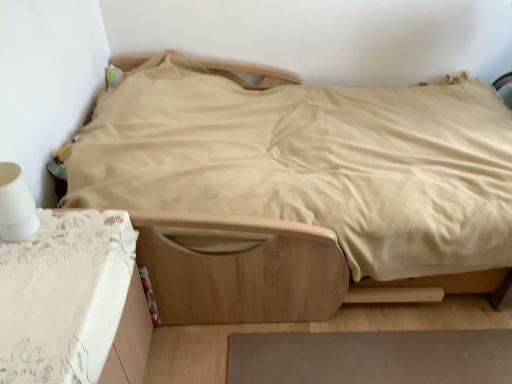
Question: Is white lace tablecloth at lower left thinner than brown matte rug at lower center?

Choices:
 (A) yes
 (B) no

Answer: (A)

Question: From a real-world perspective, is white lace tablecloth at lower left under brown matte rug at lower center?

Choices:
 (A) yes
 (B) no

Answer: (B)

Question: Considering the relative sizes of white lace tablecloth at lower left and brown matte rug at lower center in the image provided, is white lace tablecloth at lower left taller than brown matte rug at lower center?

Choices:
 (A) no
 (B) yes

Answer: (B)

Question: Considering the relative positions of white lace tablecloth at lower left and brown matte rug at lower center in the image provided, is white lace tablecloth at lower left in front of brown matte rug at lower center?

Choices:
 (A) no
 (B) yes

Answer: (B)

Question: Could you tell me if white lace tablecloth at lower left is turned towards brown matte rug at lower center?

Choices:
 (A) no
 (B) yes

Answer: (B)

Question: Can you confirm if white lace tablecloth at lower left is smaller than brown matte rug at lower center?

Choices:
 (A) no
 (B) yes

Answer: (A)

Question: Considering the relative sizes of white lace tablecloth at lower left and white matte table lamp at left in the image provided, is white lace tablecloth at lower left smaller than white matte table lamp at left?

Choices:
 (A) yes
 (B) no

Answer: (B)

Question: Is white lace tablecloth at lower left looking in the opposite direction of white matte table lamp at left?

Choices:
 (A) yes
 (B) no

Answer: (B)

Question: From a real-world perspective, is white lace tablecloth at lower left under white matte table lamp at left?

Choices:
 (A) no
 (B) yes

Answer: (B)

Question: Is white lace tablecloth at lower left positioned behind white matte table lamp at left?

Choices:
 (A) yes
 (B) no

Answer: (B)

Question: Is white lace tablecloth at lower left taller than white matte table lamp at left?

Choices:
 (A) yes
 (B) no

Answer: (A)

Question: Does white lace tablecloth at lower left appear on the right side of white matte table lamp at left?

Choices:
 (A) yes
 (B) no

Answer: (A)

Question: Is brown matte rug at lower center surrounding light brown wooden bed at center?

Choices:
 (A) no
 (B) yes

Answer: (A)